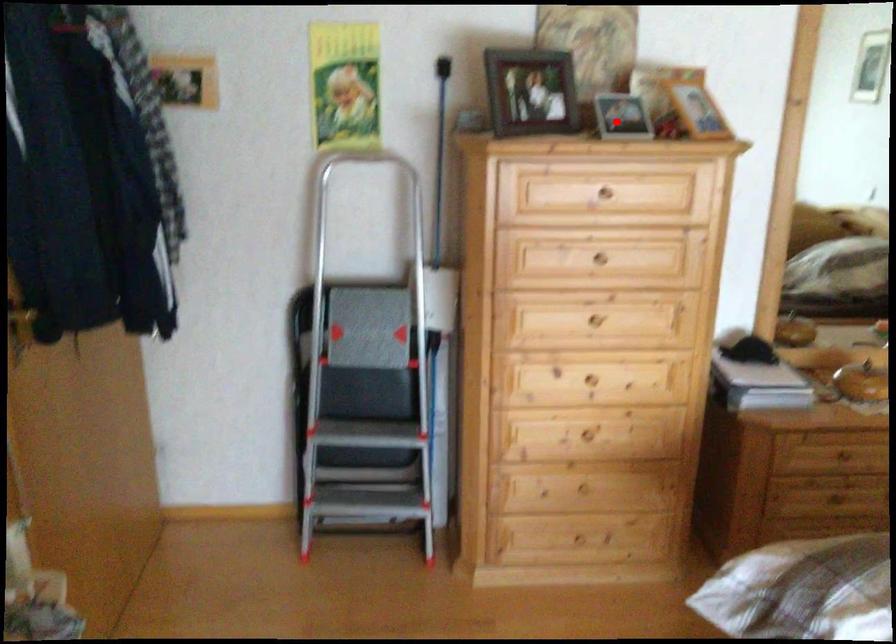
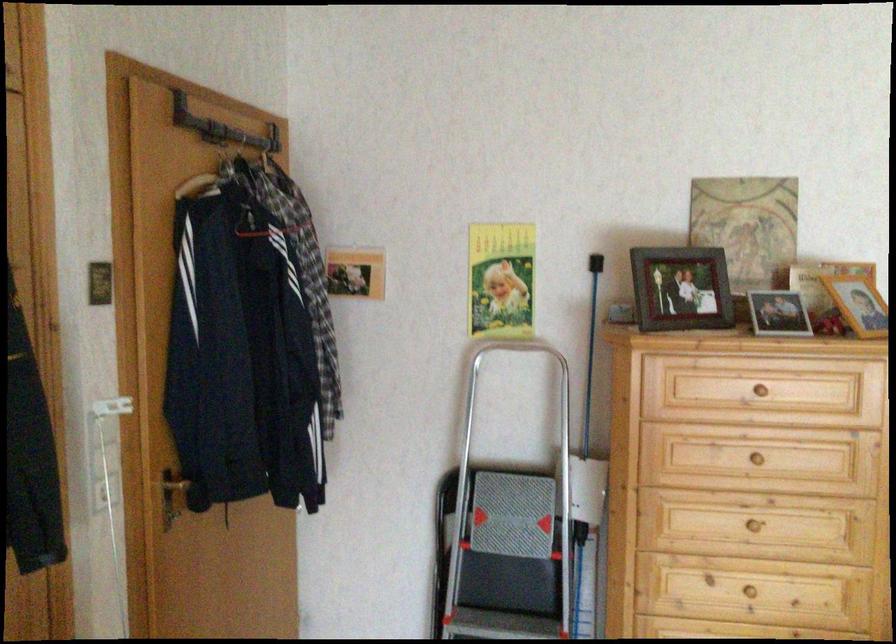
Find the pixel in the second image that matches the highlighted location in the first image.

(778, 313)